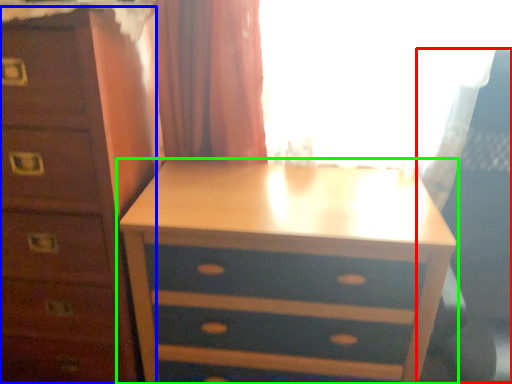
Question: Based on their relative distances, which object is nearer to swivel chair (highlighted by a red box)? Choose from chest of drawers (highlighted by a blue box) and nightstand (highlighted by a green box).

Choices:
 (A) chest of drawers
 (B) nightstand

Answer: (B)